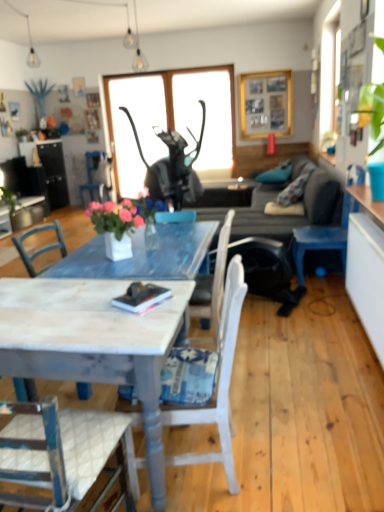
In order to face hardcover book at center, should I rotate leftwards or rightwards?

Turn left by 6.291 degrees to look at hardcover book at center.

In order to face blue painted wood chair at right, arranged as the second chair when viewed from the back, should I rotate leftwards or rightwards?

You should look right and rotate roughly 17.060 degrees.

Measure the distance between point [117,215] and camera.

Point [117,215] and camera are 2.29 meters apart.

You are a GUI agent. You are given a task and a screenshot of the screen. Output one action in this format:
    pyautogui.click(x=<x>, y=<y>)
    Task: Click on the white glossy vase at center
    
    Given the screenshot: What is the action you would take?
    115,226

Find the location of `metallic black cat statue at upper center, the second window screen viewed from the right`. metallic black cat statue at upper center, the second window screen viewed from the right is located at coordinates (136, 127).

In the image, is metallic black cat statue at upper center, the second window screen viewed from the right, positioned in front of or behind blue painted wood chair at center, the 3th chair when ordered from right to left?

Clearly, metallic black cat statue at upper center, the second window screen viewed from the right, is behind blue painted wood chair at center, the 3th chair when ordered from right to left.

Locate an element on the screen. This screenshot has height=512, width=384. chair that appears on the left of metallic black cat statue at upper center, the first window screen positioned from the left is located at coordinates (92, 177).

Is metallic black cat statue at upper center, the second window screen viewed from the right, positioned beyond the bounds of blue painted wood chair at center, the 3th chair when ordered from right to left?

Absolutely, metallic black cat statue at upper center, the second window screen viewed from the right, is external to blue painted wood chair at center, the 3th chair when ordered from right to left.

From a real-world perspective, who is located lower, metallic black cat statue at upper center, the second window screen viewed from the right, or blue painted wood chair at center, which appears as the third chair when viewed from the front?

blue painted wood chair at center, which appears as the third chair when viewed from the front.

Is blue painted wood chair at right, which is the 3th chair in left-to-right order, wider than white glossy vase at center?

Yes, blue painted wood chair at right, which is the 3th chair in left-to-right order, is wider than white glossy vase at center.

From a real-world perspective, who is located higher, blue painted wood chair at right, which is the 3th chair in left-to-right order, or white glossy vase at center?

white glossy vase at center, from a real-world perspective.

The image size is (384, 512). I want to click on the 1st chair below the white glossy vase at center (from a real-world perspective), so click(x=323, y=238).

From a real-world perspective, who is located higher, transparent glass window screen at center, the 2th window screen viewed from the left, or dark gray fabric couch at center?

transparent glass window screen at center, the 2th window screen viewed from the left, from a real-world perspective.

From the picture: Looking at their sizes, would you say transparent glass window screen at center, which is the 1th window screen from right to left, is wider or thinner than dark gray fabric couch at center?

Considering their sizes, transparent glass window screen at center, which is the 1th window screen from right to left, looks slimmer than dark gray fabric couch at center.

How different are the orientations of transparent glass window screen at center, the 2th window screen viewed from the left, and dark gray fabric couch at center in degrees?

90.7 degrees separate the facing orientations of transparent glass window screen at center, the 2th window screen viewed from the left, and dark gray fabric couch at center.

Is white glossy vase at center located outside metallic black cat statue at upper center, the first window screen positioned from the left?

Yes, white glossy vase at center is not within metallic black cat statue at upper center, the first window screen positioned from the left.

Which of these two, white glossy vase at center or metallic black cat statue at upper center, the first window screen positioned from the left, stands taller?

Standing taller between the two is metallic black cat statue at upper center, the first window screen positioned from the left.

Who is smaller, white glossy vase at center or metallic black cat statue at upper center, the first window screen positioned from the left?

Smaller between the two is white glossy vase at center.

Considering the relative sizes of metallic black cat statue at upper center, the first window screen positioned from the left, and white glossy vase at center in the image provided, is metallic black cat statue at upper center, the first window screen positioned from the left, thinner than white glossy vase at center?

Yes, metallic black cat statue at upper center, the first window screen positioned from the left, is thinner than white glossy vase at center.

Considering the relative sizes of metallic black cat statue at upper center, the second window screen viewed from the right, and white glossy vase at center in the image provided, is metallic black cat statue at upper center, the second window screen viewed from the right, shorter than white glossy vase at center?

In fact, metallic black cat statue at upper center, the second window screen viewed from the right, may be taller than white glossy vase at center.

Based on the photo, is there a large distance between metallic black cat statue at upper center, the second window screen viewed from the right, and white glossy vase at center?

That's right, there is a large distance between metallic black cat statue at upper center, the second window screen viewed from the right, and white glossy vase at center.

In the scene shown: From the image's perspective, which is below, blue painted wood chair at center, which appears as the 1th chair when viewed from the back, or white painted wood desk at center?

white painted wood desk at center is shown below in the image.

Is blue painted wood chair at center, which ranks as the 1th chair in top-to-bottom order, oriented towards white painted wood desk at center?

No, blue painted wood chair at center, which ranks as the 1th chair in top-to-bottom order, is not oriented towards white painted wood desk at center.

Is blue painted wood chair at center, which appears as the third chair when viewed from the front, to the left of white painted wood desk at center from the viewer's perspective?

Correct, you'll find blue painted wood chair at center, which appears as the third chair when viewed from the front, to the left of white painted wood desk at center.

Can you tell me how much blue painted wood chair at center, the 3th chair when ordered from right to left, and white painted wood desk at center differ in facing direction?

90.6 degrees.

Is blue painted wood chair at center, the 1th chair viewed from the left, inside or outside of blue painted wood chair at right, arranged as the second chair when viewed from the back?

The correct answer is: outside.

Considering the relative sizes of blue painted wood chair at center, the 3th chair when ordered from bottom to top, and blue painted wood chair at right, arranged as the second chair when viewed from the back, in the image provided, is blue painted wood chair at center, the 3th chair when ordered from bottom to top, shorter than blue painted wood chair at right, arranged as the second chair when viewed from the back,?

Indeed, blue painted wood chair at center, the 3th chair when ordered from bottom to top, has a lesser height compared to blue painted wood chair at right, arranged as the second chair when viewed from the back.

Is blue painted wood chair at center, the 1th chair viewed from the left, positioned behind blue painted wood chair at right, arranged as the second chair when viewed from the front?

Yes, the depth of blue painted wood chair at center, the 1th chair viewed from the left, is greater than that of blue painted wood chair at right, arranged as the second chair when viewed from the front.

Locate an element on the screen. The width and height of the screenshot is (384, 512). the 1st chair below the metallic black cat statue at upper center, the first window screen positioned from the left (from the image's perspective) is located at coordinates (92, 177).

Where is `houseplant on the left side of blue painted wood chair at right, the second chair in the bottom-to-top sequence`? This screenshot has height=512, width=384. houseplant on the left side of blue painted wood chair at right, the second chair in the bottom-to-top sequence is located at coordinates [115, 226].

From the image, which object appears to be farther from matte glass light fixture at upper center, transparent glass window screen at center, which is the 1th window screen from right to left, or green leafy plant at upper left?

green leafy plant at upper left.

Looking at the image, which one is located further to hardcover book at center, metallic black cat statue at upper center, the first window screen positioned from the left, or blue painted wood chair at right, acting as the second chair starting from the top?

Among the two, metallic black cat statue at upper center, the first window screen positioned from the left, is located further to hardcover book at center.

When comparing their distances from matte glass light fixture at upper center, does dark gray fabric couch at center or white painted wood chair at center, positioned as the second chair in left-to-right order, seem further?

white painted wood chair at center, positioned as the second chair in left-to-right order, is further to matte glass light fixture at upper center.

Based on the photo, which object lies further to the anchor point matte glass light fixture at upper center, transparent glass window screen at center, the 2th window screen viewed from the left, or white painted wood desk at center?

white painted wood desk at center is positioned further to the anchor matte glass light fixture at upper center.

Looking at the image, which one is located further to wooden picture frame at upper center, matte glass light fixture at upper center or white glossy vase at center?

Based on the image, white glossy vase at center appears to be further to wooden picture frame at upper center.

Estimate the real-world distances between objects in this image. Which object is closer to white glossy vase at center, transparent glass window screen at center, which is the 1th window screen from right to left, or hardcover book at center?

Based on the image, hardcover book at center appears to be nearer to white glossy vase at center.

Considering their positions, is white glossy vase at center positioned closer to white painted wood chair at center, which appears as the first chair when ordered from the bottom, than blue painted wood chair at right, placed as the first chair when sorted from right to left?

The object closer to white painted wood chair at center, which appears as the first chair when ordered from the bottom, is white glossy vase at center.

From the image, which object appears to be nearer to green leafy plant at upper left, wooden picture frame at upper center or blue painted wood chair at right, the second chair in the bottom-to-top sequence?

The object closer to green leafy plant at upper left is wooden picture frame at upper center.

You are a GUI agent. You are given a task and a screenshot of the screen. Output one action in this format:
    pyautogui.click(x=<x>, y=<y>)
    Task: Click on the book positioned between white painted wood chair at center, positioned as the second chair in left-to-right order, and transparent glass window screen at center, which is the 1th window screen from right to left, from near to far
    This screenshot has height=512, width=384.
    Given the screenshot: What is the action you would take?
    coord(141,297)

What are the coordinates of `lamp positioned between white painted wood desk at center and blue painted wood chair at center, the 3th chair when ordered from right to left, from near to far` in the screenshot? It's located at (135, 46).

In order to click on houseplant between hardcover book at center and transparent glass window screen at center, the 2th window screen viewed from the left, from front to back in this screenshot , I will do `click(115, 226)`.

In order to click on houseplant positioned between white painted wood desk at center and green leafy plant at upper left from near to far in this screenshot , I will do `click(115, 226)`.